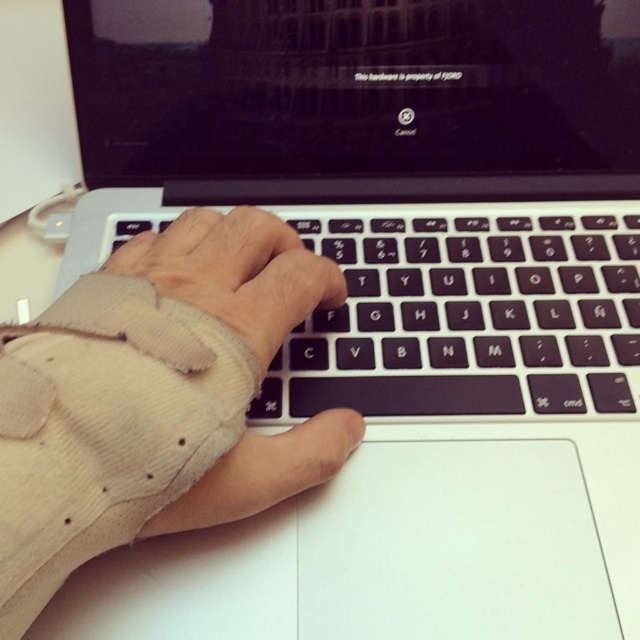
Does beige corduroy sleeve at center have a smaller size compared to black matte keyboard at center?

Indeed, beige corduroy sleeve at center has a smaller size compared to black matte keyboard at center.

Does beige corduroy sleeve at center have a greater width compared to black matte keyboard at center?

No.

Does point (128, 513) lie behind point (401, 224)?

No, it is not.

Where is `beige corduroy sleeve at center`? beige corduroy sleeve at center is located at coordinates (154, 400).